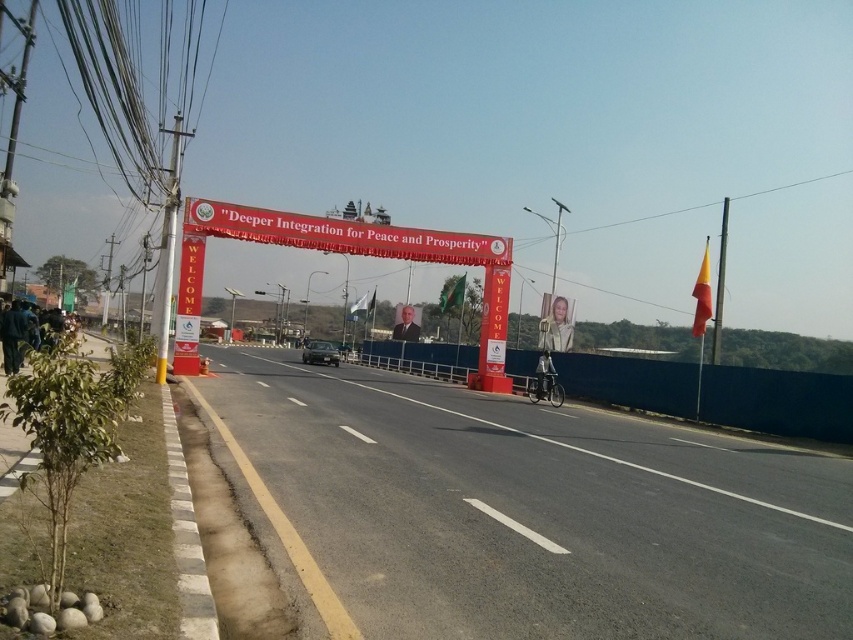
Between red fabric banner at center and shiny black car at center, which one has less height?

shiny black car at center is shorter.

Is red fabric banner at center to the left of shiny black car at center from the viewer's perspective?

In fact, red fabric banner at center is to the right of shiny black car at center.

The image size is (853, 640). Describe the element at coordinates (344, 253) in the screenshot. I see `red fabric banner at center` at that location.

Identify the location of red fabric banner at center. (344, 253).

Can you confirm if blue concrete barrier at center is bigger than shiny black car at center?

Correct, blue concrete barrier at center is larger in size than shiny black car at center.

What do you see at coordinates (778, 401) in the screenshot? Image resolution: width=853 pixels, height=640 pixels. I see `blue concrete barrier at center` at bounding box center [778, 401].

The height and width of the screenshot is (640, 853). What are the coordinates of `blue concrete barrier at center` in the screenshot? It's located at pos(778,401).

Where is `blue concrete barrier at center`? This screenshot has height=640, width=853. blue concrete barrier at center is located at coordinates (778, 401).

Measure the distance between blue concrete barrier at center and red fabric banner at center.

blue concrete barrier at center is 30.29 feet from red fabric banner at center.

Locate an element on the screen. This screenshot has width=853, height=640. blue concrete barrier at center is located at coordinates (778, 401).

Which is behind, point (799, 422) or point (463, 253)?

Positioned behind is point (463, 253).

I want to click on blue concrete barrier at center, so click(x=778, y=401).